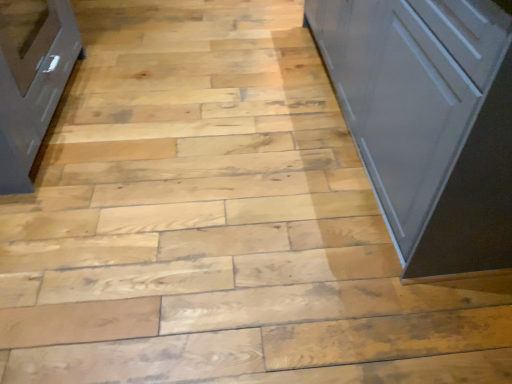
This screenshot has width=512, height=384. Find the location of `empty space that is to the right of matte gray cabinet at left`. empty space that is to the right of matte gray cabinet at left is located at coordinates [180, 136].